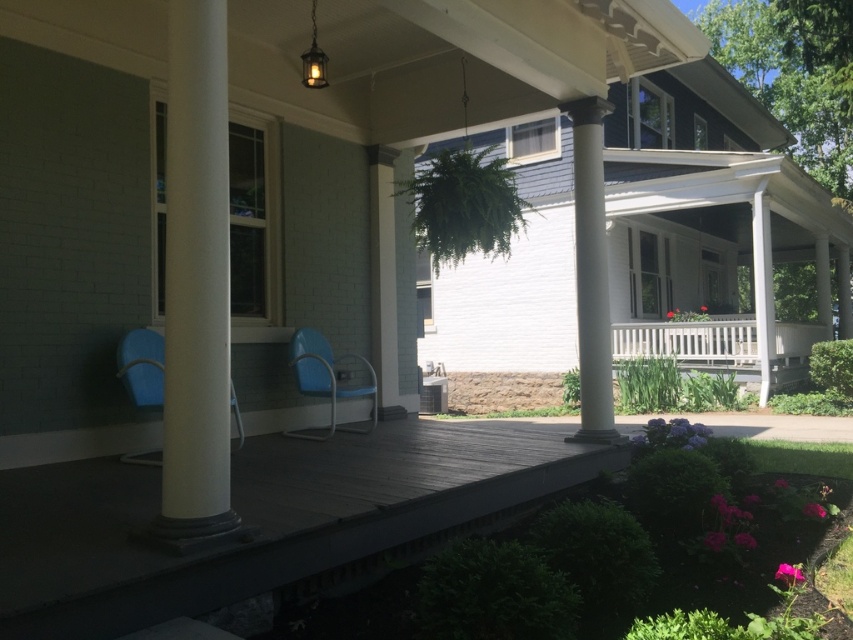
You are a painter who needs to paint both columns on the porch. You have a ladder that can reach up to 2 meters. The white polished column at center is 2.5 meters tall. Can you paint the white glossy column at center without needing a taller ladder?

The white glossy column at center is shorter than the white polished column at center, which is 2.5 meters tall. Since the ladder can reach up to 2 meters, the painter can paint the white glossy column at center without needing a taller ladder because it is shorter than 2.5 meters and the ladder can reach 2 meters.

You are standing on the wooden deck of the porch and want to move from the blue plastic rocking chair at center to the white glossy column at center. Which direction should you move to reach the column?

The white glossy column at center is positioned on the right side of the blue plastic rocking chair at center, so you should move to your right to reach the column.